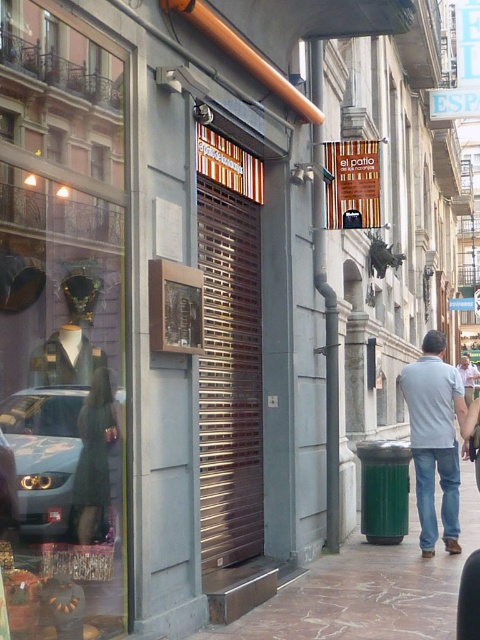
You are standing at the corner of the street looking at the storefront with the closed security shutter. There is a point marked at coordinates point [369,588]. What does this point indicate?

The point [369,588] marks the brown marble pavement at lower right.

You are a delivery person standing on the brown marble pavement at lower right and need to place a package on the blue denim jeans at lower right. Can you reach the jeans without stepping off the pavement?

The brown marble pavement at lower right is shorter than blue denim jeans at lower right, so you cannot reach the jeans without stepping off the pavement because the jeans are taller.